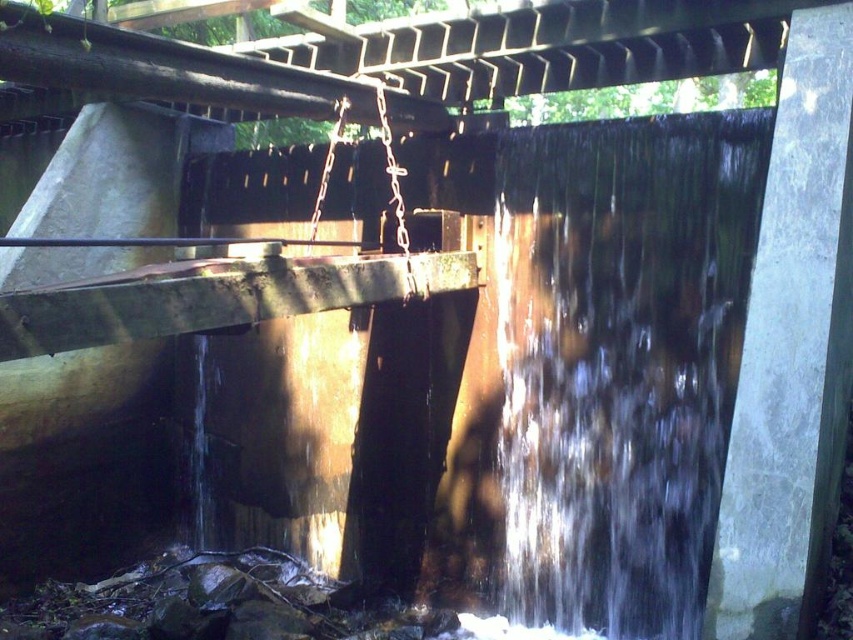
Which is in front, point (579, 435) or point (241, 294)?

Positioned in front is point (241, 294).

Does clear water at center have a lesser width compared to rusty metal beam at center?

Indeed, clear water at center has a lesser width compared to rusty metal beam at center.

Where is `clear water at center`? This screenshot has width=853, height=640. clear water at center is located at coordinates click(x=619, y=360).

Is clear water at center wider than rusty metal beam at upper center?

Incorrect, clear water at center's width does not surpass rusty metal beam at upper center's.

Is clear water at center to the right of rusty metal beam at upper center from the viewer's perspective?

Yes, clear water at center is to the right of rusty metal beam at upper center.

Locate an element on the screen. Image resolution: width=853 pixels, height=640 pixels. clear water at center is located at coordinates click(x=619, y=360).

Is point (80, 304) closer to camera compared to point (12, 52)?

Yes, point (80, 304) is closer to viewer.

Is rusty metal beam at center positioned behind rusty metal beam at upper center?

No.

The image size is (853, 640). Find the location of `rusty metal beam at center`. rusty metal beam at center is located at coordinates (215, 296).